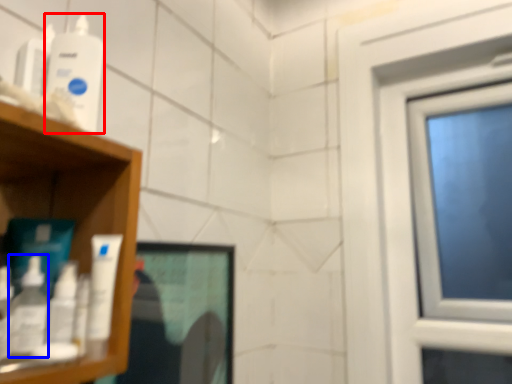
Question: Among these objects, which one is nearest to the camera, mouthwash (highlighted by a red box) or mouthwash (highlighted by a blue box)?

Choices:
 (A) mouthwash
 (B) mouthwash

Answer: (B)